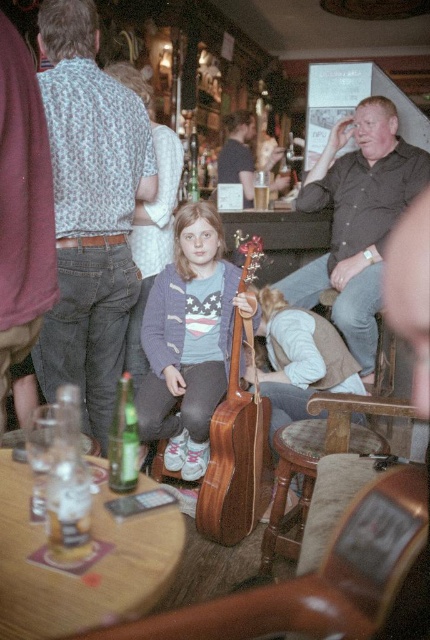
What is the color of the object located at the coordinates point (189, 340) in the image?

The object at point (189, 340) is a matte gray sweater at center.

You are a photographer setting up for a photo shoot in the pub. You need to position a spotlight so it illuminates both the matte brown guitar at center and the dark brown leather jacket at upper right without overlapping their light areas. Based on their positions, which object should be placed to the left of the other to achieve this?

The matte brown guitar at center should be placed to the right of the dark brown leather jacket at upper right so that their light areas do not overlap. Since the guitar is already on the right side of the jacket, positioning them this way allows the spotlight to illuminate each object separately.

You are a customer at the bar and want to place your phone on the wooden table at center. However, there is a green glass bottle at table left in the way. Can you place your phone there without moving the bottle?

The wooden table at center is below the green glass bottle at table left, so the bottle is likely placed on the table. Therefore, you can place your phone on the wooden table at center next to the green glass bottle at table left without moving it.